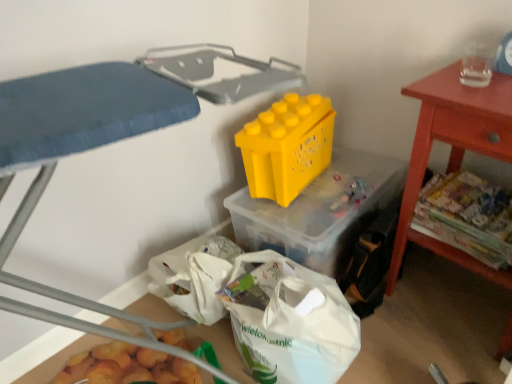
Describe the element at coordinates (320, 211) in the screenshot. I see `yellow plastic storage box at center, which is the 1th storage box in right-to-left order` at that location.

In order to face yellow plastic toy at center, should I rotate leftwards or rightwards?

Turn right approximately 4.619 degrees to face it.

The height and width of the screenshot is (384, 512). What do you see at coordinates (111, 122) in the screenshot?
I see `yellow plastic storage bin at upper center` at bounding box center [111, 122].

Where is `yellow plastic storage box at center, placed as the second storage box when sorted from left to right`? This screenshot has width=512, height=384. yellow plastic storage box at center, placed as the second storage box when sorted from left to right is located at coordinates (320, 211).

Is yellow plastic storage box at center, placed as the second storage box when sorted from left to right, positioned beyond the bounds of white plastic bag at lower center, marked as the 2th storage box in a top-to-bottom arrangement?

That's correct, yellow plastic storage box at center, placed as the second storage box when sorted from left to right, is outside of white plastic bag at lower center, marked as the 2th storage box in a top-to-bottom arrangement.

Which is farther, (324, 237) or (112, 326)?

Positioned behind is point (324, 237).

From their relative heights in the image, would you say yellow plastic storage box at center, positioned as the second storage box in bottom-to-top order, is taller or shorter than white plastic bag at lower center, marked as the 2th storage box in a top-to-bottom arrangement?

Clearly, yellow plastic storage box at center, positioned as the second storage box in bottom-to-top order, is taller compared to white plastic bag at lower center, marked as the 2th storage box in a top-to-bottom arrangement.

At what (x,y) coordinates should I click in order to perform the action: click on storage box that appears below the yellow plastic storage box at center, which is the 1th storage box in right-to-left order (from a real-world perspective). Please return your answer as a coordinate pair (x, y). Looking at the image, I should click on (220, 347).

Which object is closer to the camera taking this photo, printed paper magazines at right or yellow plastic storage box at center, which appears as the 1th storage box when viewed from the top?

printed paper magazines at right is more forward.

From the image's perspective, which is above, printed paper magazines at right or yellow plastic storage box at center, placed as the second storage box when sorted from left to right?

yellow plastic storage box at center, placed as the second storage box when sorted from left to right.

Is printed paper magazines at right looking in the opposite direction of yellow plastic storage box at center, which appears as the 1th storage box when viewed from the top?

No, printed paper magazines at right is not facing the opposite direction of yellow plastic storage box at center, which appears as the 1th storage box when viewed from the top.

Do you think printed paper magazines at right is within yellow plastic storage box at center, which appears as the 1th storage box when viewed from the top, or outside of it?

printed paper magazines at right is spatially situated outside yellow plastic storage box at center, which appears as the 1th storage box when viewed from the top.

Consider the image. Considering the sizes of objects yellow plastic storage bin at upper center and yellow plastic toy at center in the image provided, who is shorter, yellow plastic storage bin at upper center or yellow plastic toy at center?

yellow plastic toy at center.

Does yellow plastic storage bin at upper center appear on the right side of yellow plastic toy at center?

No, yellow plastic storage bin at upper center is not to the right of yellow plastic toy at center.

Is yellow plastic storage bin at upper center oriented towards yellow plastic toy at center?

Yes, yellow plastic storage bin at upper center is aimed at yellow plastic toy at center.

From the image's perspective, which is below, yellow plastic storage bin at upper center or yellow plastic toy at center?

yellow plastic storage bin at upper center, from the image's perspective.

How different are the orientations of yellow plastic toy at center and yellow plastic storage box at center, which is the 1th storage box in right-to-left order, in degrees?

The angle between the facing direction of yellow plastic toy at center and the facing direction of yellow plastic storage box at center, which is the 1th storage box in right-to-left order, is 98 degrees.

Is yellow plastic toy at center taller or shorter than yellow plastic storage box at center, which appears as the 1th storage box when viewed from the top?

yellow plastic toy at center is shorter than yellow plastic storage box at center, which appears as the 1th storage box when viewed from the top.

Between yellow plastic toy at center and yellow plastic storage box at center, positioned as the second storage box in bottom-to-top order, which one is positioned in front?

yellow plastic storage box at center, positioned as the second storage box in bottom-to-top order, is in front.

Based on the photo, are yellow plastic toy at center and yellow plastic storage box at center, placed as the second storage box when sorted from left to right, located far from each other?

They are positioned close to each other.

From the image's perspective, between yellow plastic storage bin at upper center and yellow plastic storage box at center, which appears as the 1th storage box when viewed from the top, which one is located above?

yellow plastic storage box at center, which appears as the 1th storage box when viewed from the top, from the image's perspective.

Relative to yellow plastic storage box at center, which appears as the 1th storage box when viewed from the top, is yellow plastic storage bin at upper center in front or behind?

yellow plastic storage bin at upper center is positioned closer to the viewer than yellow plastic storage box at center, which appears as the 1th storage box when viewed from the top.

Is point (68, 123) closer or farther from the camera than point (369, 194)?

Point (68, 123) appears to be closer to the viewer than point (369, 194).

Is yellow plastic storage box at center, positioned as the second storage box in bottom-to-top order, oriented towards printed paper magazines at right?

No, yellow plastic storage box at center, positioned as the second storage box in bottom-to-top order, is not oriented towards printed paper magazines at right.

Between yellow plastic storage box at center, which appears as the 1th storage box when viewed from the top, and printed paper magazines at right, which one has less height?

With less height is printed paper magazines at right.

Based on the photo, is printed paper magazines at right a part of yellow plastic storage box at center, which appears as the 1th storage box when viewed from the top?

No, printed paper magazines at right is not surrounded by yellow plastic storage box at center, which appears as the 1th storage box when viewed from the top.

Considering the relative sizes of yellow plastic storage box at center, placed as the second storage box when sorted from left to right, and printed paper magazines at right in the image provided, is yellow plastic storage box at center, placed as the second storage box when sorted from left to right, wider than printed paper magazines at right?

Indeed, yellow plastic storage box at center, placed as the second storage box when sorted from left to right, has a greater width compared to printed paper magazines at right.

Measure the distance from yellow plastic toy at center to smooth red table at right.

yellow plastic toy at center and smooth red table at right are 16.69 inches apart.

Could smooth red table at right be considered to be inside yellow plastic toy at center?

No, smooth red table at right is not surrounded by yellow plastic toy at center.

You are a GUI agent. You are given a task and a screenshot of the screen. Output one action in this format:
    pyautogui.click(x=<x>, y=<y>)
    Task: Click on the toy above the smooth red table at right (from the image's perspective)
    
    Given the screenshot: What is the action you would take?
    pyautogui.click(x=287, y=146)

From a real-world perspective, which is physically above, yellow plastic toy at center or smooth red table at right?

From a 3D spatial view, yellow plastic toy at center is above.

In the image, there is a white plastic bag at lower center, which appears as the 2th storage box when viewed from the right. Where is `storage box above it (from the image's perspective)`? The width and height of the screenshot is (512, 384). storage box above it (from the image's perspective) is located at coordinates (320, 211).

Image resolution: width=512 pixels, height=384 pixels. Find the location of `food that appears above the yellow plastic storage box at center, placed as the second storage box when sorted from left to right (from a real-world perspective)`. food that appears above the yellow plastic storage box at center, placed as the second storage box when sorted from left to right (from a real-world perspective) is located at coordinates 467,216.

Which object lies further to the anchor point printed paper magazines at right, yellow plastic toy at center or smooth red table at right?

The object further to printed paper magazines at right is yellow plastic toy at center.

Which object lies further to the anchor point yellow plastic toy at center, yellow plastic storage bin at upper center or printed paper magazines at right?

Based on the image, yellow plastic storage bin at upper center appears to be further to yellow plastic toy at center.

Based on their spatial positions, is printed paper magazines at right or yellow plastic storage bin at upper center closer to smooth red table at right?

Based on the image, printed paper magazines at right appears to be nearer to smooth red table at right.

Estimate the real-world distances between objects in this image. Which object is further from white plastic bag at lower center, which appears as the first storage box when ordered from the bottom, printed paper magazines at right or yellow plastic toy at center?

Among the two, printed paper magazines at right is located further to white plastic bag at lower center, which appears as the first storage box when ordered from the bottom.

Consider the image. From the image, which object appears to be nearer to white plastic bag at lower center, the 1th storage box when ordered from left to right, yellow plastic toy at center or yellow plastic storage box at center, placed as the second storage box when sorted from left to right?

Based on the image, yellow plastic storage box at center, placed as the second storage box when sorted from left to right, appears to be nearer to white plastic bag at lower center, the 1th storage box when ordered from left to right.

From the image, which object appears to be nearer to white plastic bag at lower center, which appears as the first storage box when ordered from the bottom, printed paper magazines at right or yellow plastic storage box at center, which is the 1th storage box in right-to-left order?

Among the two, yellow plastic storage box at center, which is the 1th storage box in right-to-left order, is located nearer to white plastic bag at lower center, which appears as the first storage box when ordered from the bottom.

When comparing their distances from yellow plastic storage box at center, which appears as the 1th storage box when viewed from the top, does white plastic bag at lower center, which appears as the 2th storage box when viewed from the right, or smooth red table at right seem further?

Based on the image, white plastic bag at lower center, which appears as the 2th storage box when viewed from the right, appears to be further to yellow plastic storage box at center, which appears as the 1th storage box when viewed from the top.

Looking at the image, which one is located further to yellow plastic toy at center, yellow plastic storage box at center, positioned as the second storage box in bottom-to-top order, or smooth red table at right?

smooth red table at right is further to yellow plastic toy at center.

The image size is (512, 384). Identify the location of storage box between yellow plastic storage bin at upper center and smooth red table at right in the horizontal direction. (320, 211).

Where is `storage box situated between yellow plastic toy at center and smooth red table at right from left to right`? storage box situated between yellow plastic toy at center and smooth red table at right from left to right is located at coordinates (320, 211).

The height and width of the screenshot is (384, 512). Find the location of `toy between yellow plastic storage bin at upper center and smooth red table at right in the horizontal direction`. toy between yellow plastic storage bin at upper center and smooth red table at right in the horizontal direction is located at coordinates (287, 146).

Where is `food between yellow plastic storage bin at upper center and smooth red table at right from left to right`? Image resolution: width=512 pixels, height=384 pixels. food between yellow plastic storage bin at upper center and smooth red table at right from left to right is located at coordinates (467, 216).